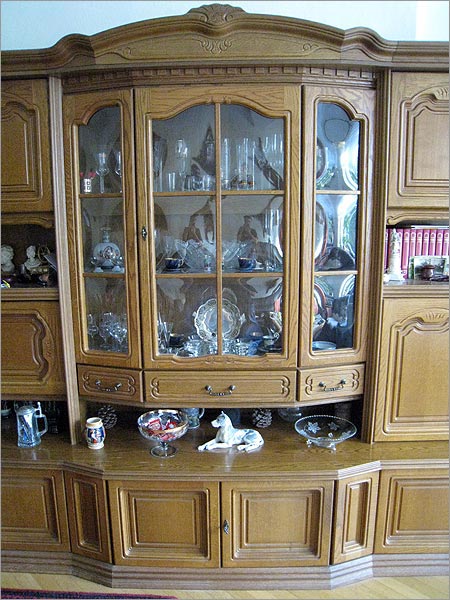
The width and height of the screenshot is (450, 600). Identify the location of bust. (31, 259).